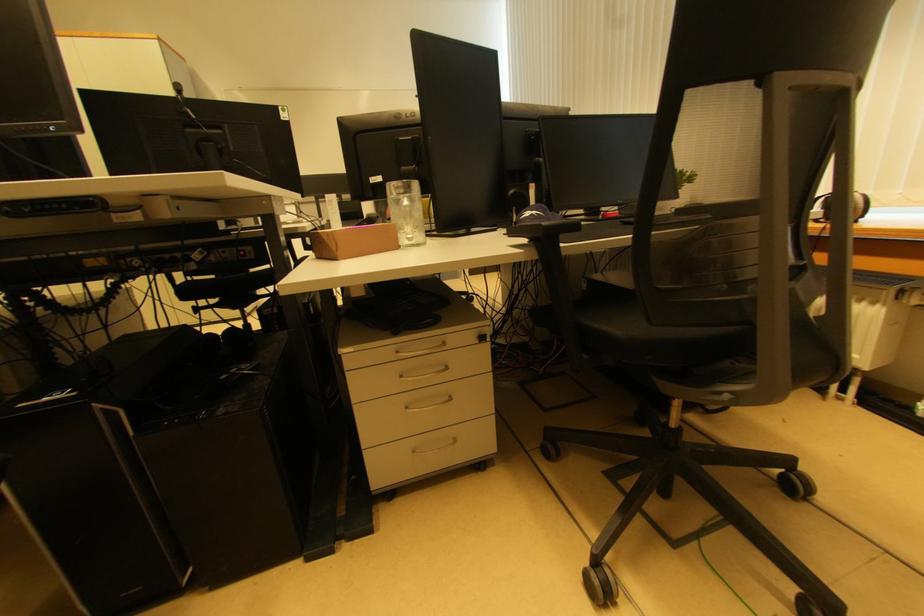
This screenshot has height=616, width=924. Identify the location of chair armrest. (544, 225).